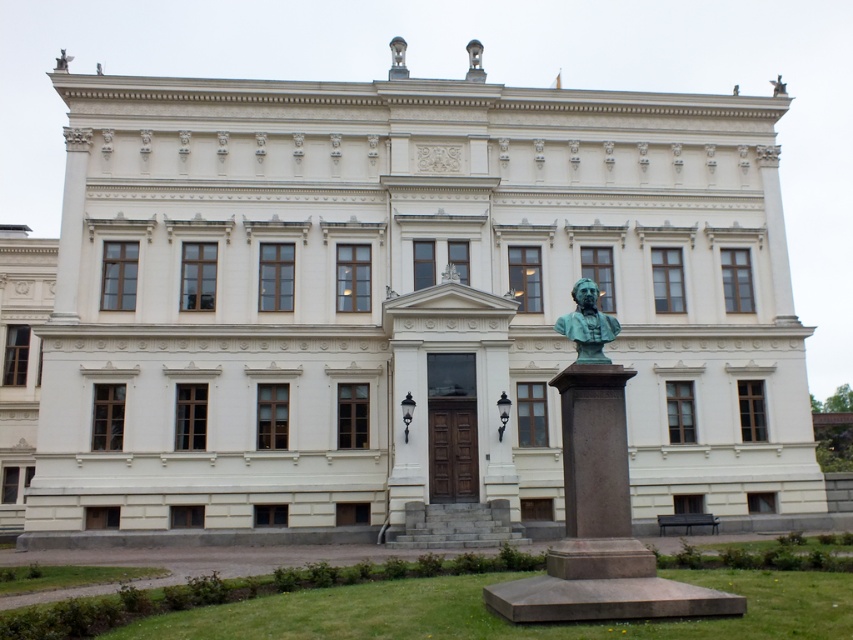
Question: Does bronze bust at center lie behind bronze statue at upper center?

Choices:
 (A) yes
 (B) no

Answer: (B)

Question: Can you confirm if bronze bust at center is positioned to the right of bronze statue at upper center?

Choices:
 (A) no
 (B) yes

Answer: (B)

Question: Among these points, which one is nearest to the camera?

Choices:
 (A) (67, 58)
 (B) (585, 312)

Answer: (B)

Question: In this image, where is bronze bust at center located relative to bronze statue at upper center?

Choices:
 (A) below
 (B) above

Answer: (A)

Question: Among these points, which one is farthest from the camera?

Choices:
 (A) (67, 61)
 (B) (590, 282)

Answer: (A)